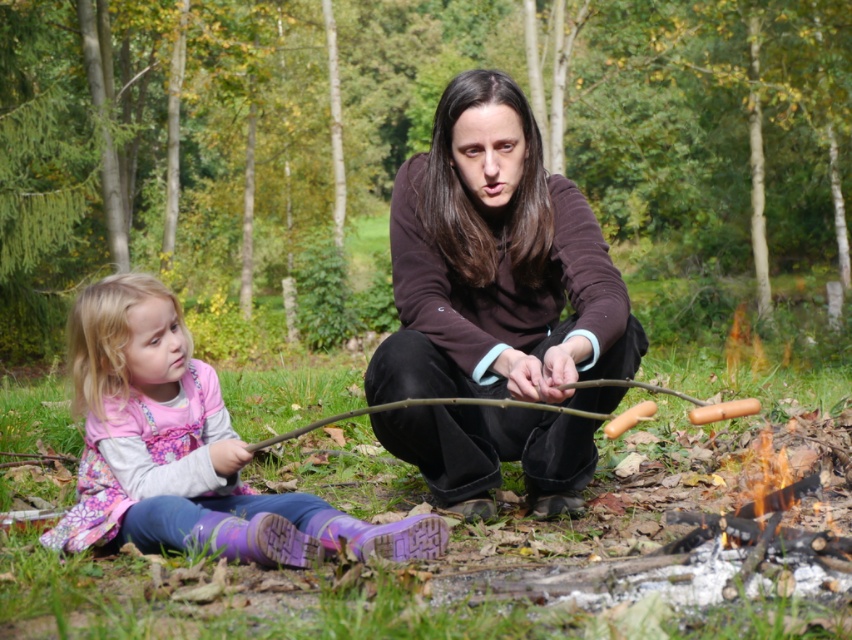
Question: Which point appears closest to the camera in this image?

Choices:
 (A) (59, 547)
 (B) (436, 241)
 (C) (265, 445)

Answer: (C)

Question: Is brown matte sweater at center below brown smooth stick at center?

Choices:
 (A) no
 (B) yes

Answer: (A)

Question: Does brown matte sweater at center have a smaller size compared to pink floral dress at left?

Choices:
 (A) yes
 (B) no

Answer: (B)

Question: Among these objects, which one is nearest to the camera?

Choices:
 (A) brown matte sweater at center
 (B) pink floral dress at left

Answer: (A)

Question: Which point appears farthest from the camera in this image?

Choices:
 (A) (410, 400)
 (B) (392, 524)

Answer: (B)

Question: Where is brown matte sweater at center located in relation to brown smooth stick at center in the image?

Choices:
 (A) right
 (B) left

Answer: (A)